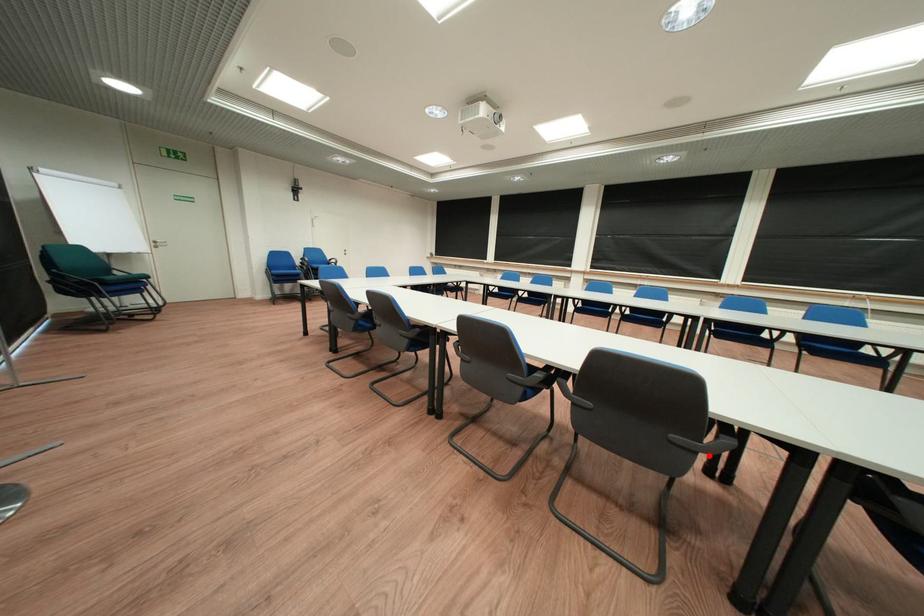
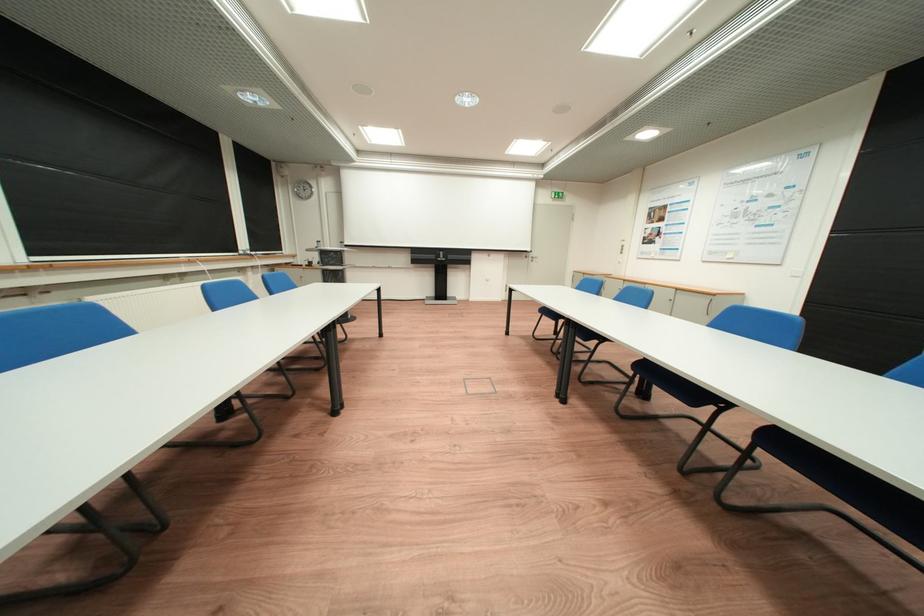
Question: I am providing you with two images of the same scene from different viewpoints. A red point is marked on the first image. At the location where the point appears in image 1, is it still visible in image 2?

Choices:
 (A) Yes
 (B) No

Answer: (B)